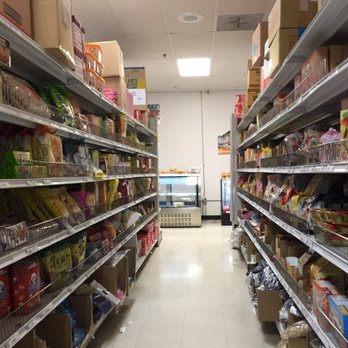
The height and width of the screenshot is (348, 348). Find the location of `shelves`. shelves is located at coordinates (136, 148), (131, 173), (135, 196), (143, 219), (147, 251), (275, 271), (302, 236), (308, 171).